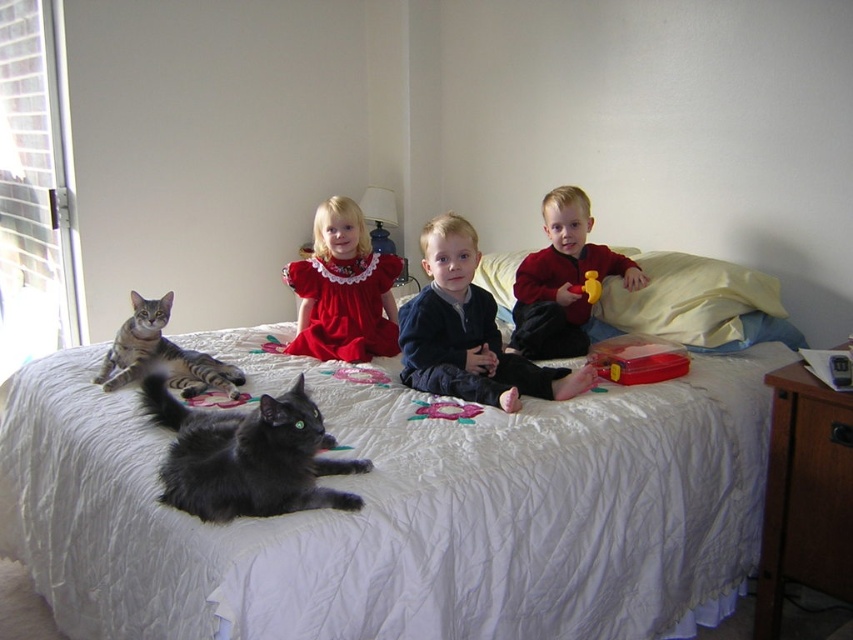
Question: Is velvet red sweater at center below soft plush cat at center?

Choices:
 (A) yes
 (B) no

Answer: (B)

Question: Which object is the farthest from the matte red dress at center?

Choices:
 (A) shiny black cat at center
 (B) yellow rubber duck at center right
 (C) soft plush cat at center

Answer: (A)

Question: Which point is closer to the camera taking this photo?

Choices:
 (A) (236, 371)
 (B) (460, 413)

Answer: (B)

Question: Is white quilted bed at center closer to camera compared to matte red dress at center?

Choices:
 (A) no
 (B) yes

Answer: (B)

Question: Can you confirm if shiny black cat at center is bigger than embroidered fabric flower at center?

Choices:
 (A) no
 (B) yes

Answer: (B)

Question: Among these objects, which one is nearest to the camera?

Choices:
 (A) velvet red sweater at center
 (B) shiny black cat at center
 (C) yellow rubber duck at center right
 (D) white quilted bed at center

Answer: (D)